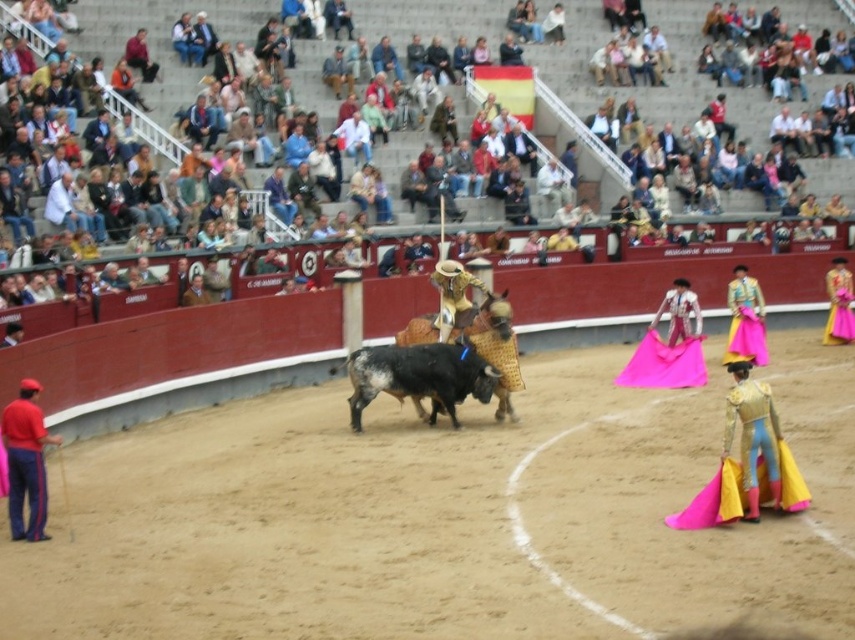
Question: Which point is farther to the camera?

Choices:
 (A) black glossy bull at center
 (B) multicolored fabric seats at upper center

Answer: (B)

Question: Is multicolored fabric seats at upper center wider than red fabric pants at lower left?

Choices:
 (A) yes
 (B) no

Answer: (A)

Question: Which point is closer to the camera?

Choices:
 (A) red fabric pants at lower left
 (B) yellow satin cape at center

Answer: (A)

Question: Is black glossy bull at center in front of red fabric pants at lower left?

Choices:
 (A) yes
 (B) no

Answer: (B)

Question: Which point is farther from the camera taking this photo?

Choices:
 (A) (42, 506)
 (B) (346, 362)

Answer: (B)

Question: Does multicolored fabric seats at upper center have a larger size compared to yellow satin cape at center?

Choices:
 (A) no
 (B) yes

Answer: (B)